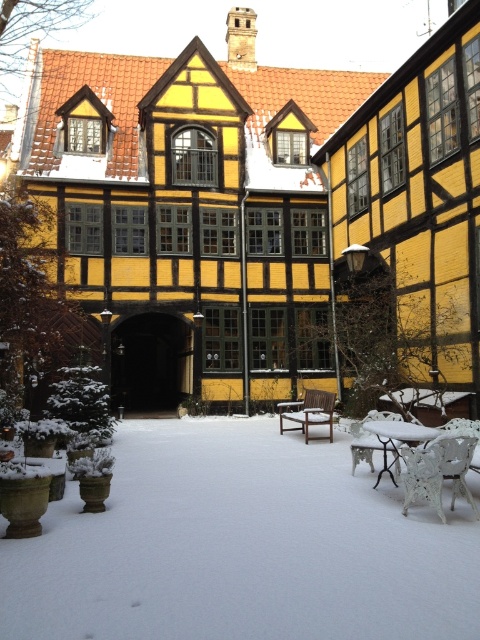
You are standing in the courtyard and want to walk from the wooden bench to the garden area. Which point, point (276,544) or point (379,419), is closer to you as you start walking?

Point (276,544) is closer to the viewer than point (379,419), so it is the closer point as you start walking.

You are planning to place a small decorative statue on the ground in the courtyard. The statue requires a flat, snowless area to be placed safely. Given the presence of the white powdery snow at lower left and the metallic silver chair at lower right, which location would be more suitable for placing the statue?

The metallic silver chair at lower right is more suitable because the white powdery snow at lower left is much taller than the metallic silver chair at lower right, meaning the snow area is deeper and less stable for placing the statue.

You are planning to host a small winter gathering in the courtyard. You need to place a round table that is 1.2 meters in diameter between the white powdery snow at lower left and the metallic silver chair at lower right. Given the sizes of these objects, will there be enough space to fit the table without overlapping either object?

The white powdery snow at lower left is larger in size than the metallic silver chair at lower right. However, the exact spatial arrangement and distance between them are not specified. Without knowing the distance between the two objects, it is impossible to determine if there is sufficient space for the 1.2 meter diameter table. Additional information about their positioning is required to answer this accurately.